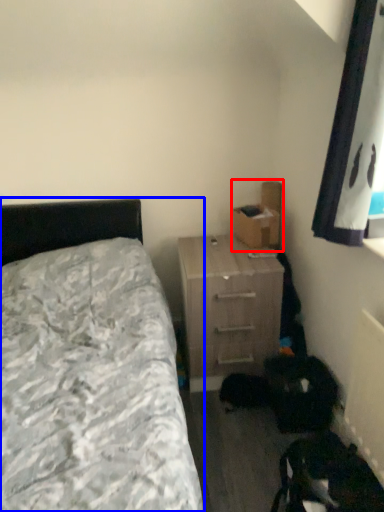
Question: Which object appears farthest to the camera in this image, cardboard box (highlighted by a red box) or bed (highlighted by a blue box)?

Choices:
 (A) cardboard box
 (B) bed

Answer: (A)